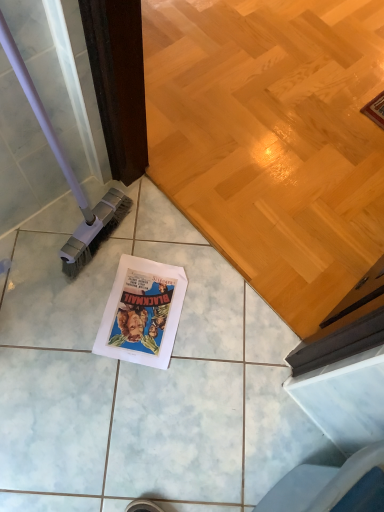
Where is `empty space that is to the right of purple plastic brush at left`? empty space that is to the right of purple plastic brush at left is located at coordinates (156, 250).